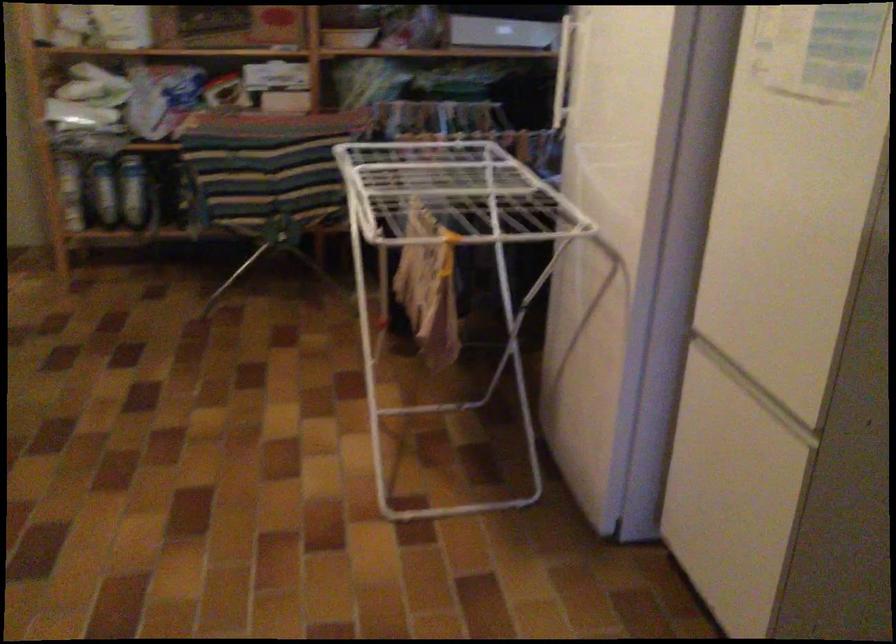
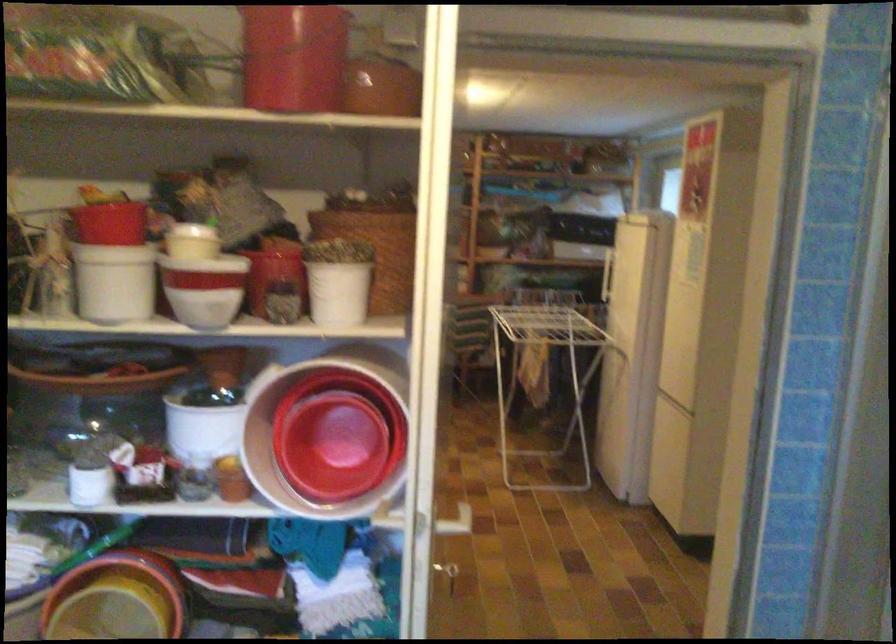
Question: I am providing you with two images of the same scene from different viewpoints. Which of the following objects are not visible in image2?

Choices:
 (A) blue bottle
 (B) red drawer handle
 (C) red plastic bowl
 (D) door frame key

Answer: (A)